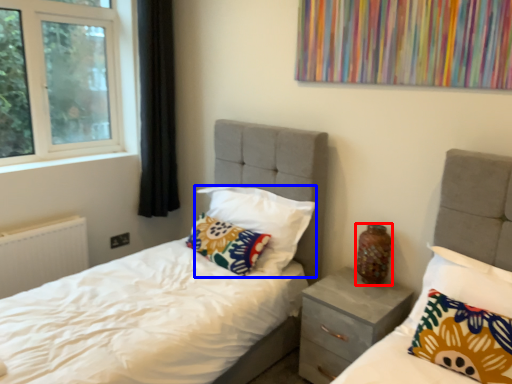
Question: Which point is further to the camera, vase (highlighted by a red box) or pillow (highlighted by a blue box)?

Choices:
 (A) vase
 (B) pillow

Answer: (B)